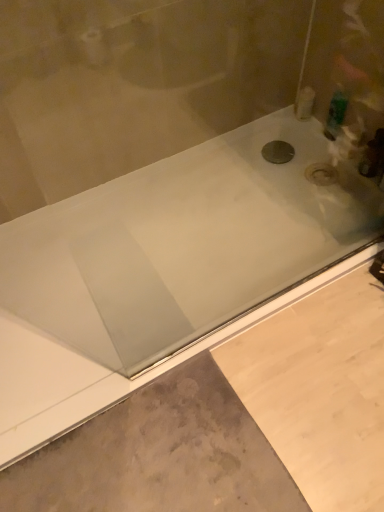
Question: Is green plastic bottle at upper right, which is the first toiletry in right-to-left order, taller or shorter than black metallic drain at center?

Choices:
 (A) tall
 (B) short

Answer: (A)

Question: Based on their sizes in the image, would you say green plastic bottle at upper right, which is the first toiletry in right-to-left order, is bigger or smaller than black metallic drain at center?

Choices:
 (A) small
 (B) big

Answer: (B)

Question: Which of these objects is positioned closest to the green plastic bottle at upper right, which is the first toiletry in right-to-left order?

Choices:
 (A) white plastic bottle at upper right, arranged as the second toiletry when viewed from the right
 (B) gray concrete at lower left
 (C) black metallic drain at center

Answer: (A)

Question: Which of these objects is positioned closest to the white plastic bottle at upper right, arranged as the first toiletry when viewed from the left?

Choices:
 (A) gray concrete at lower left
 (B) green plastic bottle at upper right, which is the first toiletry in right-to-left order
 (C) black metallic drain at center

Answer: (B)